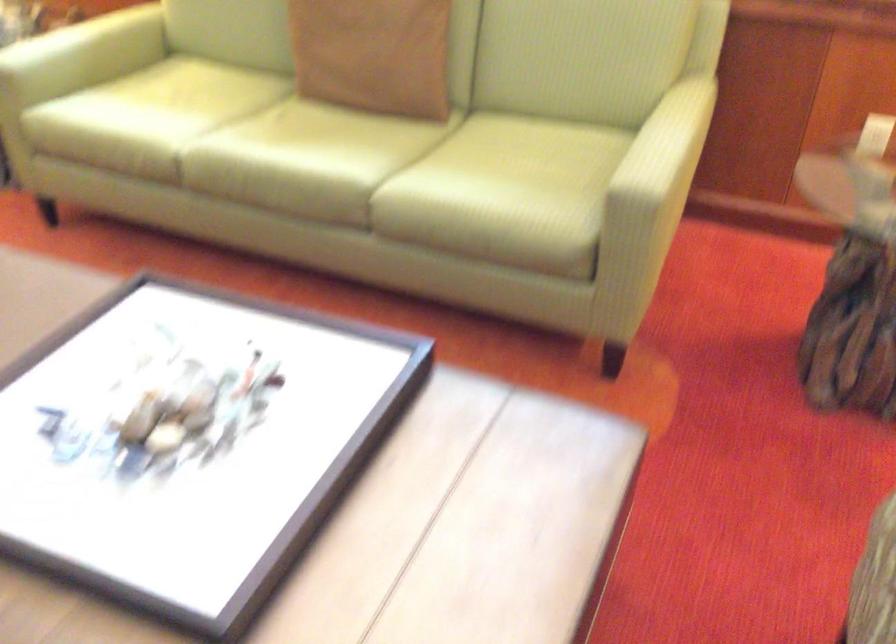
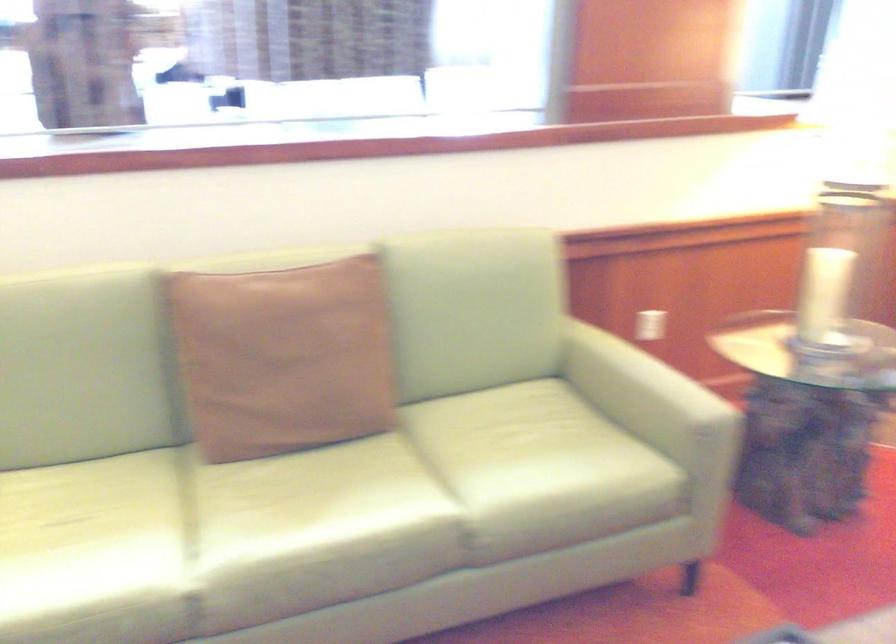
The point at (300,131) is marked in the first image. Where is the corresponding point in the second image?

(299, 498)